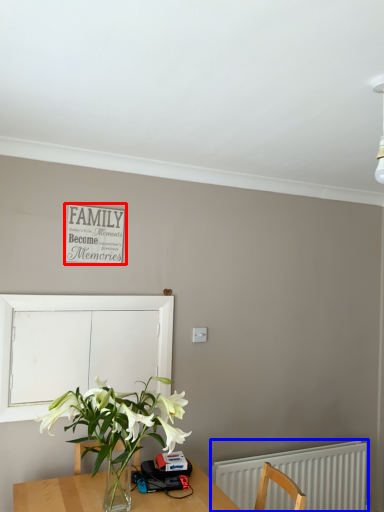
Question: Which of the following is the farthest to the observer, bulletin board (highlighted by a red box) or radiator (highlighted by a blue box)?

Choices:
 (A) bulletin board
 (B) radiator

Answer: (B)